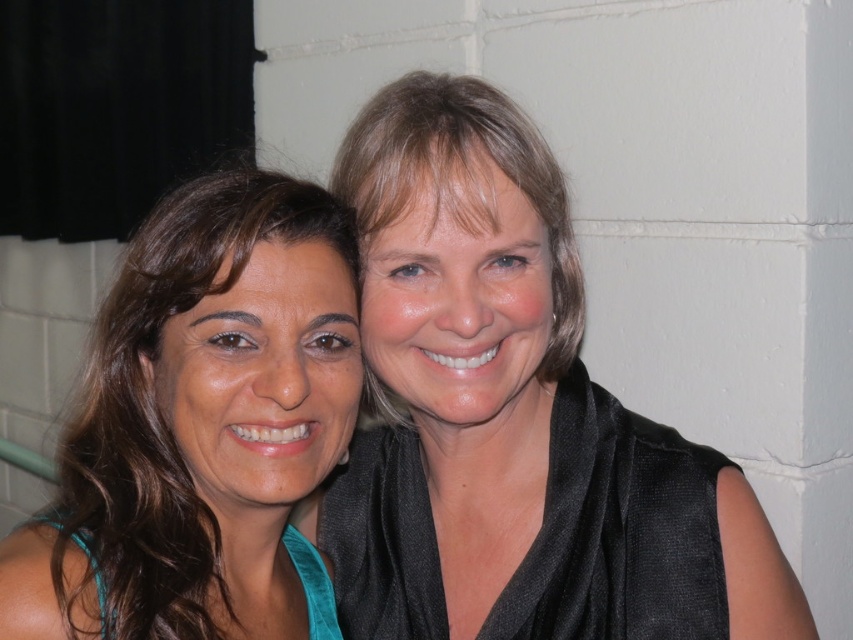
Between black satin scarf at upper right and teal fabric top at left, which one has less height?

teal fabric top at left

Who is more forward, (426, 132) or (276, 292)?

Point (276, 292) is more forward.

Locate an element on the screen. The width and height of the screenshot is (853, 640). black satin scarf at upper right is located at coordinates (514, 416).

Is point (569, 460) in front of point (549, 381)?

Yes.

Can you confirm if black satin scarf at upper right is shorter than matte black hair at upper center?

Incorrect, black satin scarf at upper right's height does not fall short of matte black hair at upper center's.

You are a GUI agent. You are given a task and a screenshot of the screen. Output one action in this format:
    pyautogui.click(x=<x>, y=<y>)
    Task: Click on the black satin scarf at upper right
    
    Given the screenshot: What is the action you would take?
    pyautogui.click(x=514, y=416)

Is teal fabric top at left behind matte black hair at upper center?

No, it is in front of matte black hair at upper center.

You are a GUI agent. You are given a task and a screenshot of the screen. Output one action in this format:
    pyautogui.click(x=<x>, y=<y>)
    Task: Click on the teal fabric top at left
    Image resolution: width=853 pixels, height=640 pixels.
    Given the screenshot: What is the action you would take?
    pyautogui.click(x=202, y=428)